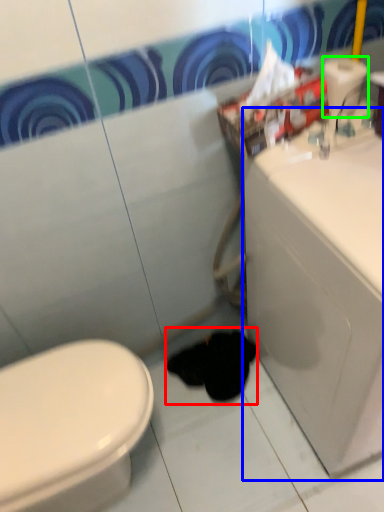
Question: Estimate the real-world distances between objects in this image. Which object is closer to animal (highlighted by a red box), porcelain (highlighted by a blue box) or toilet paper (highlighted by a green box)?

Choices:
 (A) porcelain
 (B) toilet paper

Answer: (A)